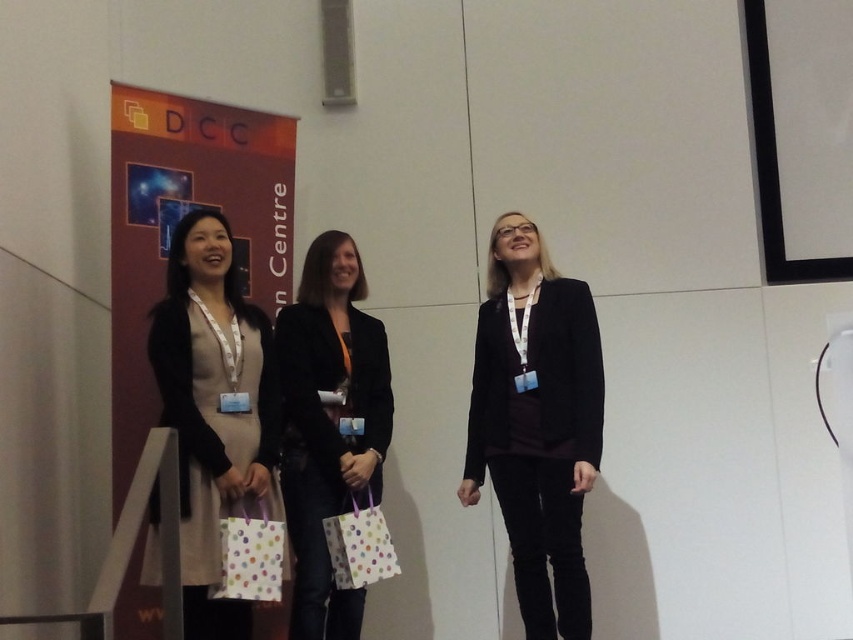
Question: Based on their relative distances, which object is nearer to the matte black blazer at center?

Choices:
 (A) white dotted paper bag at center
 (B) black matte blazer at center
 (C) polka dot paper bag at center

Answer: (B)

Question: Does matte black blazer at center have a lesser width compared to black matte blazer at center?

Choices:
 (A) no
 (B) yes

Answer: (A)

Question: Can you confirm if polka dot paper bag at center is positioned above white dotted paper bag at center?

Choices:
 (A) no
 (B) yes

Answer: (B)

Question: Which point is farther to the camera?

Choices:
 (A) matte black blazer at center
 (B) white dotted paper bag at center
 (C) black matte blazer at center

Answer: (A)

Question: Is beige fabric dress at left positioned before white dotted paper bag at center?

Choices:
 (A) yes
 (B) no

Answer: (A)

Question: Which point is closer to the camera taking this photo?

Choices:
 (A) (259, 566)
 (B) (506, 406)

Answer: (A)